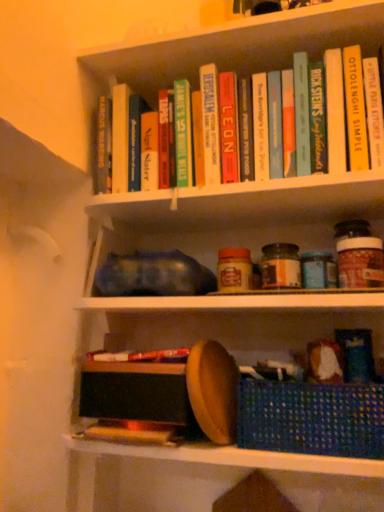
Question: Is hardcover book at upper center, the second paperback book when ordered from right to left, in front of hardcover book at upper center, the second paperback book viewed from the left?

Choices:
 (A) yes
 (B) no

Answer: (A)

Question: Is there a large distance between hardcover book at upper center, the 3th paperback book viewed from the left, and hardcover book at upper center, the second paperback book viewed from the left?

Choices:
 (A) yes
 (B) no

Answer: (B)

Question: From the image's perspective, is hardcover book at upper center, the 3th paperback book viewed from the left, located above hardcover book at upper center, the second paperback book viewed from the left?

Choices:
 (A) no
 (B) yes

Answer: (B)

Question: From the image's perspective, would you say hardcover book at upper center, the second paperback book when ordered from right to left, is shown under hardcover book at upper center, the second paperback book viewed from the left?

Choices:
 (A) no
 (B) yes

Answer: (A)

Question: Is hardcover book at upper center, the second paperback book when ordered from right to left, positioned behind hardcover book at upper center, the second paperback book viewed from the left?

Choices:
 (A) yes
 (B) no

Answer: (B)

Question: Considering the relative sizes of hardcover book at upper center, the second paperback book when ordered from right to left, and hardcover book at upper center, the third paperback book viewed from the right, in the image provided, is hardcover book at upper center, the second paperback book when ordered from right to left, wider than hardcover book at upper center, the third paperback book viewed from the right,?

Choices:
 (A) yes
 (B) no

Answer: (B)

Question: Is there a large distance between hardcover book at upper center, the 3th paperback book viewed from the left, and brown matte glass jar at center-right?

Choices:
 (A) no
 (B) yes

Answer: (A)

Question: Considering the relative sizes of hardcover book at upper center, the 3th paperback book viewed from the left, and brown matte glass jar at center-right in the image provided, is hardcover book at upper center, the 3th paperback book viewed from the left, thinner than brown matte glass jar at center-right?

Choices:
 (A) no
 (B) yes

Answer: (A)

Question: From a real-world perspective, is hardcover book at upper center, the 3th paperback book viewed from the left, physically above brown matte glass jar at center-right?

Choices:
 (A) no
 (B) yes

Answer: (B)

Question: Considering the relative sizes of hardcover book at upper center, the second paperback book when ordered from right to left, and brown matte glass jar at center-right in the image provided, is hardcover book at upper center, the second paperback book when ordered from right to left, taller than brown matte glass jar at center-right?

Choices:
 (A) yes
 (B) no

Answer: (A)

Question: Is hardcover book at upper center, the second paperback book when ordered from right to left, with brown matte glass jar at center-right?

Choices:
 (A) no
 (B) yes

Answer: (A)

Question: From a real-world perspective, is hardcover book at upper center, the second paperback book when ordered from right to left, positioned under brown matte glass jar at center-right based on gravity?

Choices:
 (A) no
 (B) yes

Answer: (A)

Question: Can you confirm if blue woven basket at lower right is wider than hardcover book at upper center, the third paperback book viewed from the right?

Choices:
 (A) yes
 (B) no

Answer: (A)